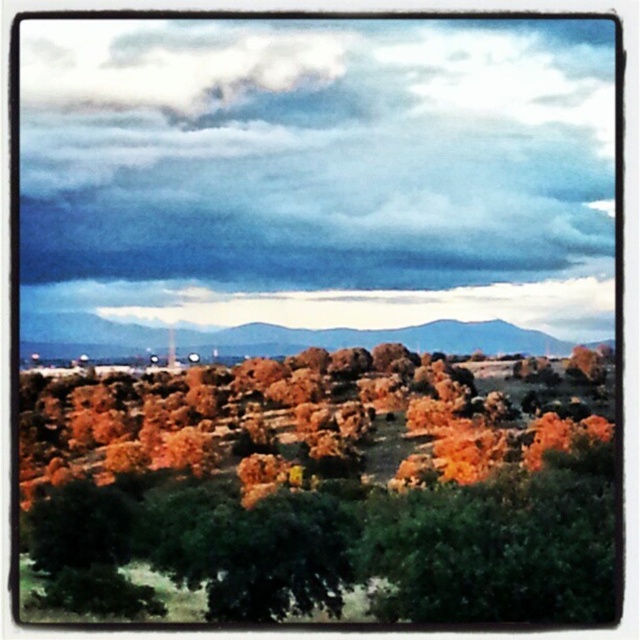
Measure the distance from orange leafy tree at center to brown rocky mountain at center.

They are 70.42 meters apart.

Does orange leafy tree at center lie in front of brown rocky mountain at center?

Yes, orange leafy tree at center is closer to the viewer.

Who is more forward, (326, 371) or (436, 330)?

Positioned in front is point (326, 371).

I want to click on orange leafy tree at center, so click(323, 490).

Looking at this image, which is below, dark cloudy sky at upper center or brown rocky mountain at center?

brown rocky mountain at center is lower down.

Is point (193, 321) positioned in front of point (61, 328)?

No, (193, 321) is further to viewer.

What do you see at coordinates (317, 172) in the screenshot?
I see `dark cloudy sky at upper center` at bounding box center [317, 172].

Identify the location of dark cloudy sky at upper center. (317, 172).

From the picture: Does dark cloudy sky at upper center appear on the left side of orange leafy tree at center?

Correct, you'll find dark cloudy sky at upper center to the left of orange leafy tree at center.

Which is more to the right, dark cloudy sky at upper center or orange leafy tree at center?

From the viewer's perspective, orange leafy tree at center appears more on the right side.

Which is in front, point (140, 20) or point (202, 609)?

Point (202, 609)

The image size is (640, 640). Find the location of `dark cloudy sky at upper center`. dark cloudy sky at upper center is located at coordinates (317, 172).